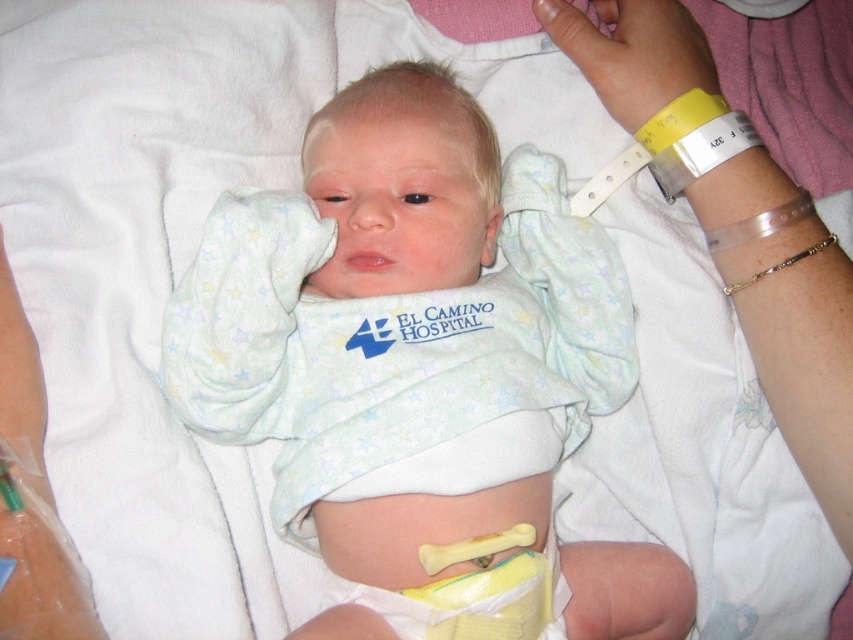
Question: Among these points, which one is nearest to the camera?

Choices:
 (A) (643, 544)
 (B) (637, 45)

Answer: (B)

Question: Which of the following is the closest to the observer?

Choices:
 (A) yellow plastic wristband at upper right
 (B) light blue cotton onesie at center

Answer: (B)

Question: Where is light blue cotton onesie at center located in relation to yellow plastic wristband at upper right in the image?

Choices:
 (A) above
 (B) below

Answer: (B)

Question: Can you confirm if light blue cotton onesie at center is wider than yellow plastic wristband at upper right?

Choices:
 (A) no
 (B) yes

Answer: (B)

Question: From the image, what is the correct spatial relationship of light blue cotton onesie at center in relation to yellow plastic wristband at upper right?

Choices:
 (A) right
 (B) left

Answer: (B)